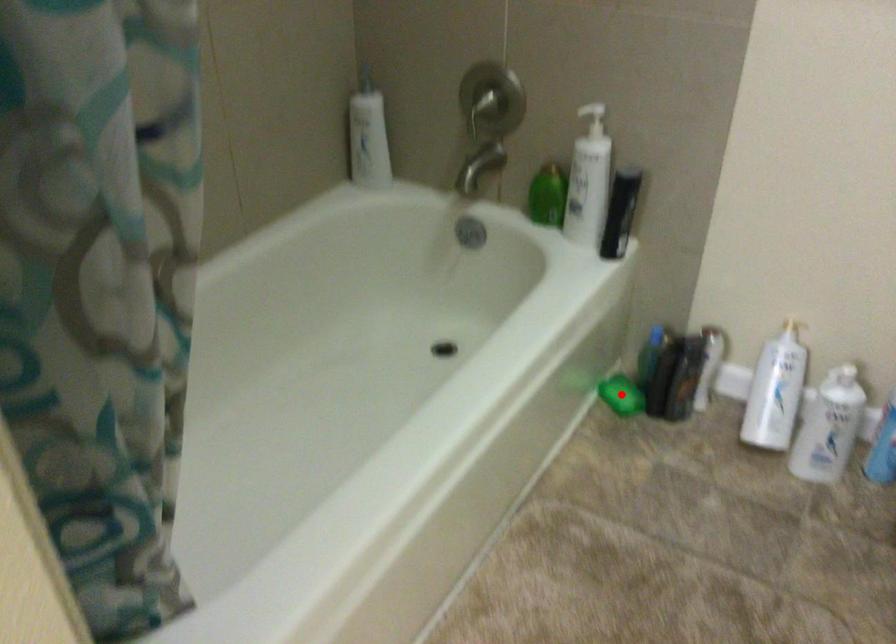
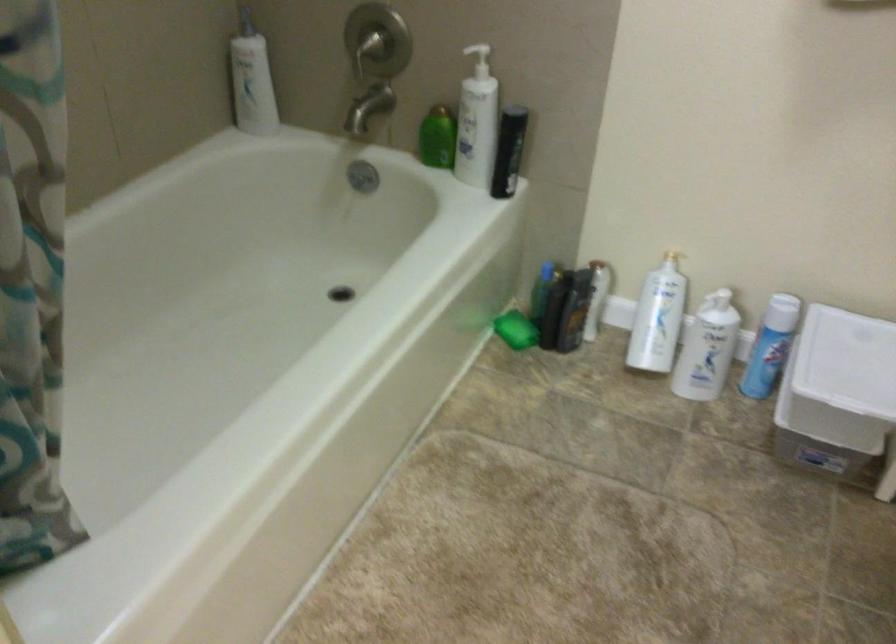
Question: I am providing you with two images of the same scene from different viewpoints. A red point is marked on the first image. At the location where the point appears in image 1, is it still visible in image 2?

Choices:
 (A) Yes
 (B) No

Answer: (A)